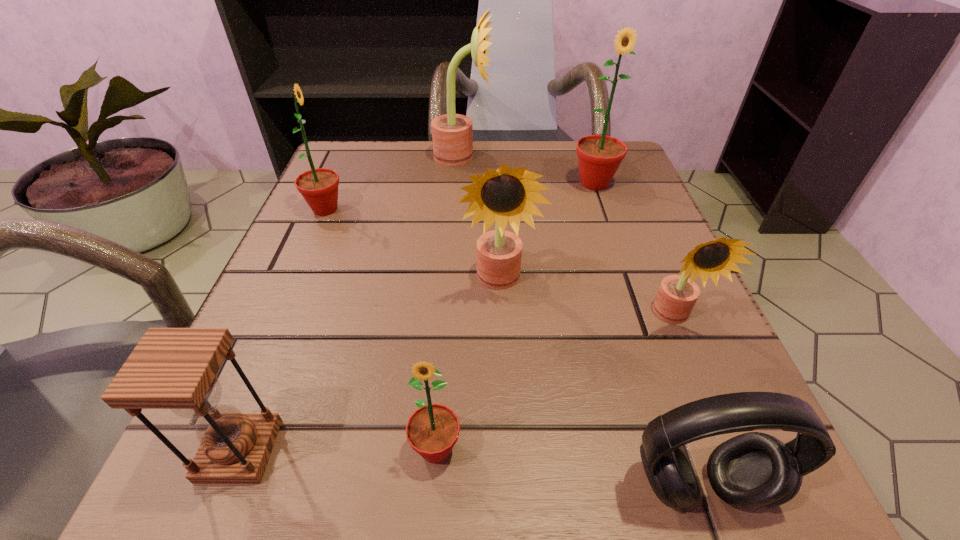
The height and width of the screenshot is (540, 960). I want to click on gray headset, so click(x=753, y=470).

Where is `blank area located on the face of the farthest yellow sunflower`? The height and width of the screenshot is (540, 960). blank area located on the face of the farthest yellow sunflower is located at coordinates (588, 157).

The height and width of the screenshot is (540, 960). I want to click on vacant space situated 0.350m on the face of the biggest green sunflower, so click(x=646, y=334).

Identify the location of vacant space located on the face of the leftmost green sunflower. (454, 210).

Find the location of a particular element. free space located 0.120m on the face of the second biggest yellow sunflower is located at coordinates (503, 372).

Where is `vacant space located on the face of the smallest yellow sunflower`? The height and width of the screenshot is (540, 960). vacant space located on the face of the smallest yellow sunflower is located at coordinates (737, 471).

Where is `free location located 0.090m on the back of the hourglass`? This screenshot has height=540, width=960. free location located 0.090m on the back of the hourglass is located at coordinates (276, 359).

Where is `sunflower at the near edge`? Image resolution: width=960 pixels, height=540 pixels. sunflower at the near edge is located at coordinates (432, 430).

At what (x,y) coordinates should I click in order to perform the action: click on hourglass located at the near edge. Please return your answer as a coordinate pair (x, y). Looking at the image, I should click on (170, 368).

Where is `headset positioned at the near edge`? The width and height of the screenshot is (960, 540). headset positioned at the near edge is located at coordinates (753, 470).